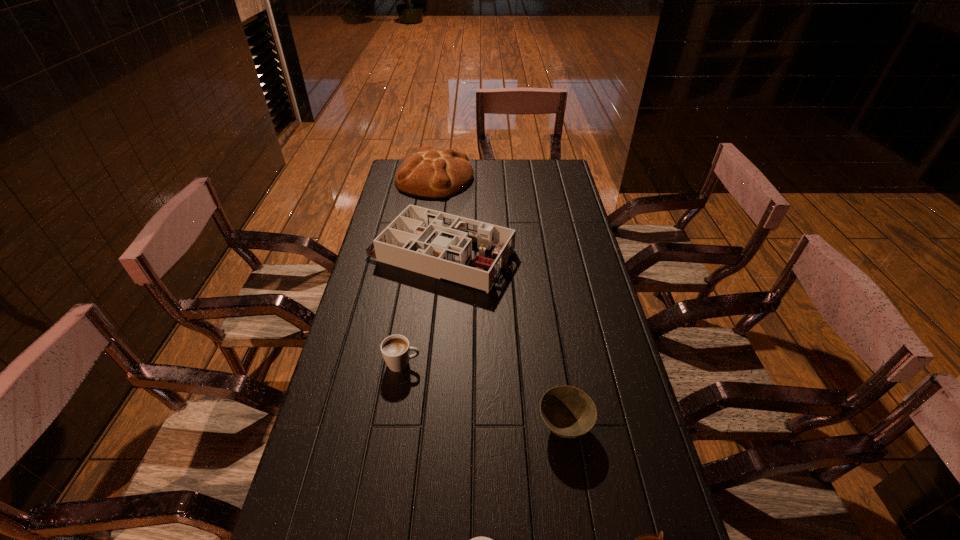
Find the location of a particular element. This screenshot has width=960, height=540. bread is located at coordinates (429, 173).

This screenshot has height=540, width=960. What are the coordinates of `the farthest object` in the screenshot? It's located at (429, 173).

Identify the location of the second farthest object. The width and height of the screenshot is (960, 540). (437, 244).

This screenshot has height=540, width=960. Identify the location of the leftmost cappuccino. point(395,349).

This screenshot has height=540, width=960. I want to click on the third farthest object, so click(x=395, y=349).

This screenshot has width=960, height=540. Find the location of `bowl`. bowl is located at coordinates (568, 412).

Image resolution: width=960 pixels, height=540 pixels. Find the location of `the second object from right to left`. the second object from right to left is located at coordinates (568, 412).

Where is `vacant space located 0.200m on the right of the tallest object`? The height and width of the screenshot is (540, 960). vacant space located 0.200m on the right of the tallest object is located at coordinates (518, 178).

This screenshot has height=540, width=960. I want to click on vacant space located 0.200m on the right of the fifth nearest object, so click(570, 253).

This screenshot has height=540, width=960. In order to click on blank space located 0.210m with the handle on the side of the farthest cappuccino in this screenshot , I will do `click(496, 363)`.